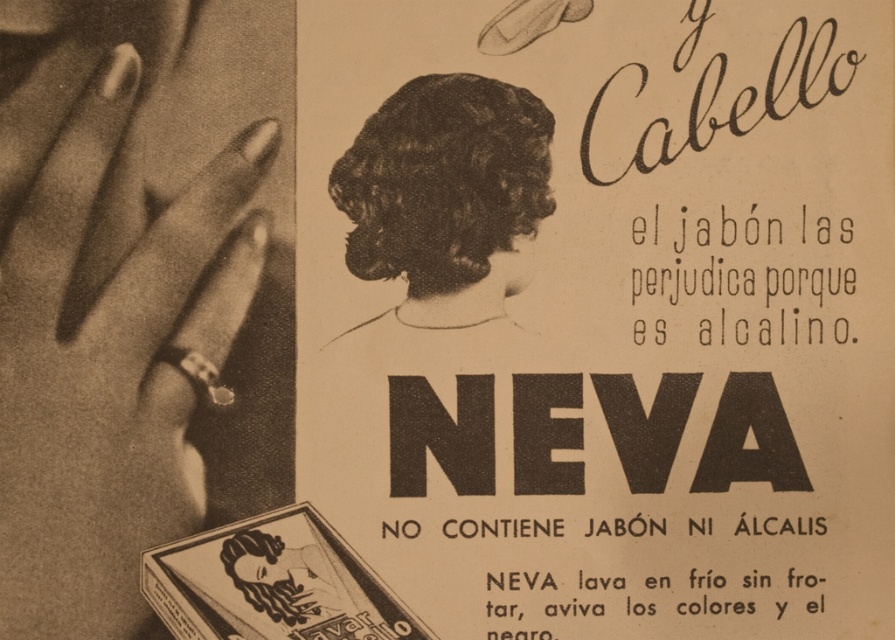
Question: Estimate the real-world distances between objects in this image. Which object is closer to the matte paper advertisement at center?

Choices:
 (A) dark curly hair at center
 (B) metallic ring at left

Answer: (A)

Question: Which of the following is the closest to the observer?

Choices:
 (A) matte paper advertisement at center
 (B) dark curly hair at center
 (C) metallic ring at left

Answer: (C)

Question: Is matte paper advertisement at center thinner than dark curly hair at center?

Choices:
 (A) yes
 (B) no

Answer: (B)

Question: Which of the following is the closest to the observer?

Choices:
 (A) matte paper advertisement at center
 (B) metallic ring at left

Answer: (B)

Question: Does metallic ring at left have a lesser width compared to dark curly hair at center?

Choices:
 (A) yes
 (B) no

Answer: (B)

Question: Is matte paper advertisement at center closer to the viewer compared to metallic ring at left?

Choices:
 (A) yes
 (B) no

Answer: (B)